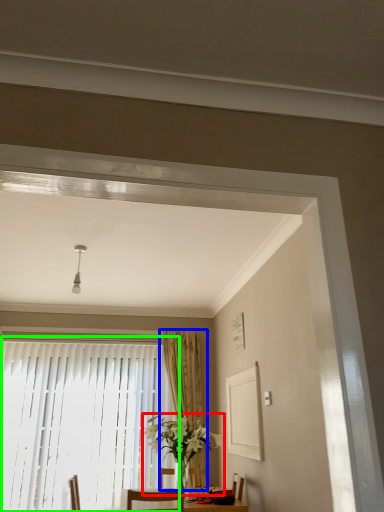
Question: Estimate the real-world distances between objects in this image. Which object is closer to houseplant (highlighted by a red box), curtain (highlighted by a blue box) or window (highlighted by a green box)?

Choices:
 (A) curtain
 (B) window

Answer: (A)